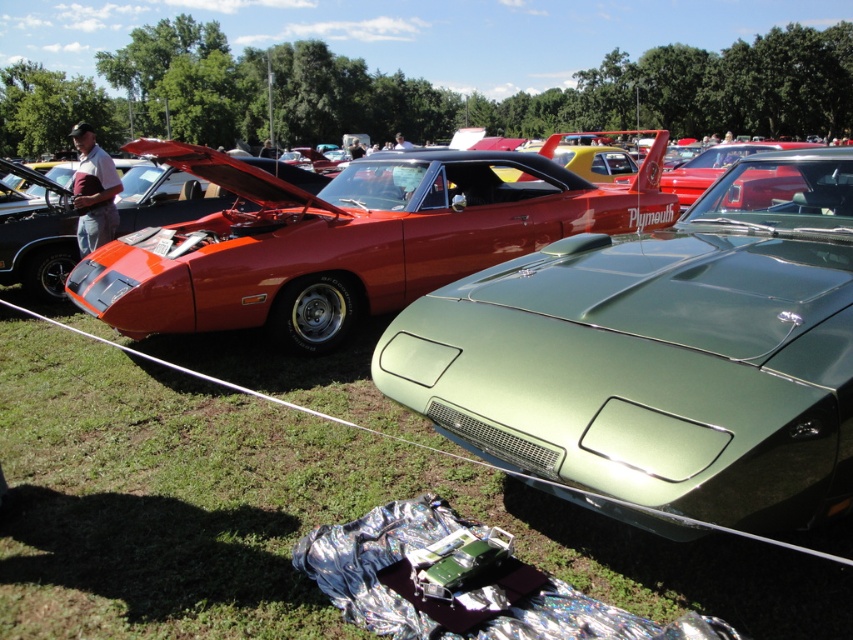
Question: Among these objects, which one is farthest from the camera?

Choices:
 (A) silver reflective foil at lower center
 (B) satin green car at center

Answer: (A)

Question: Is satin green car at center positioned behind silver reflective foil at lower center?

Choices:
 (A) no
 (B) yes

Answer: (A)

Question: Among these points, which one is farthest from the camera?

Choices:
 (A) (611, 241)
 (B) (465, 628)

Answer: (A)

Question: Considering the relative positions of satin green car at center and silver reflective foil at lower center in the image provided, where is satin green car at center located with respect to silver reflective foil at lower center?

Choices:
 (A) right
 (B) left

Answer: (A)

Question: Is satin green car at center above silver reflective foil at lower center?

Choices:
 (A) yes
 (B) no

Answer: (A)

Question: Which of the following is the closest to the observer?

Choices:
 (A) (634, 502)
 (B) (494, 541)

Answer: (A)